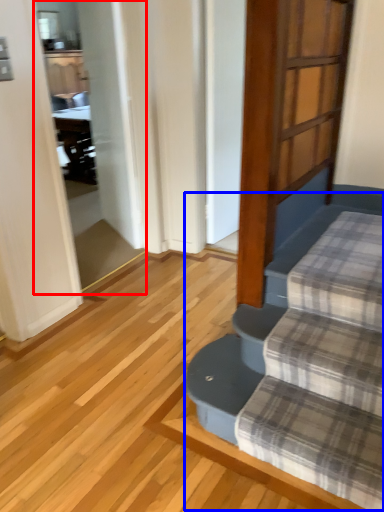
Question: Among these objects, which one is nearest to the camera, screen door (highlighted by a red box) or stairwell (highlighted by a blue box)?

Choices:
 (A) screen door
 (B) stairwell

Answer: (B)